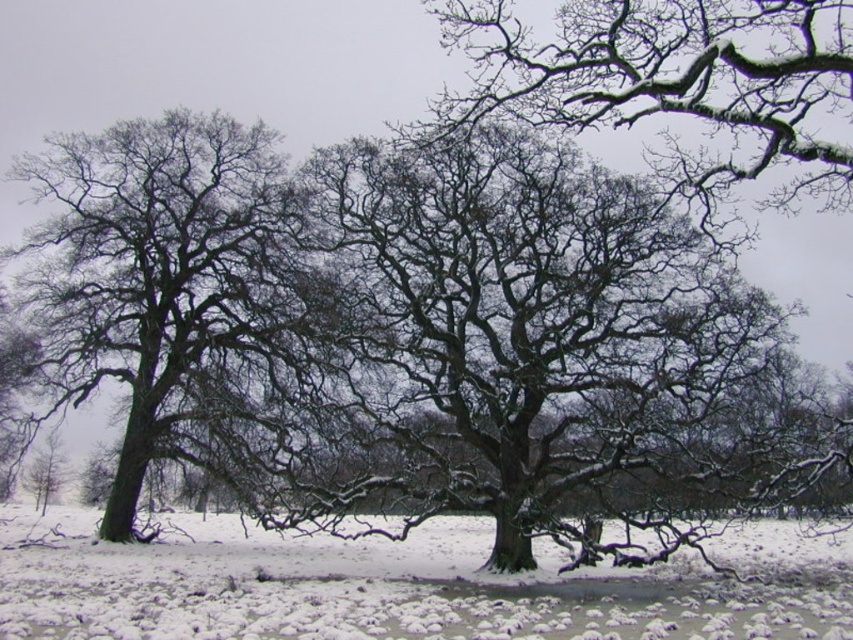
You are standing in the winter landscape and want to place a small wooden bench. The coordinates for the bench must be at least 0.5 units away from the white powdery snow at center. Where should you place the bench?

The white powdery snow at center is located at coordinates point [404,586]. To place the bench at least 0.5 units away, you should position it outside the area within 0.5 units from those coordinates, ensuring sufficient distance from the snow.